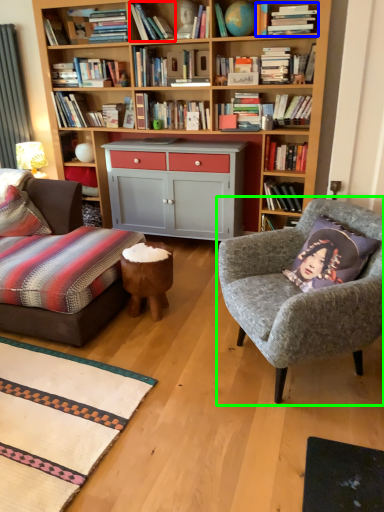
Question: Estimate the real-world distances between objects in this image. Which object is farther from book (highlighted by a red box), book (highlighted by a blue box) or chair (highlighted by a green box)?

Choices:
 (A) book
 (B) chair

Answer: (B)